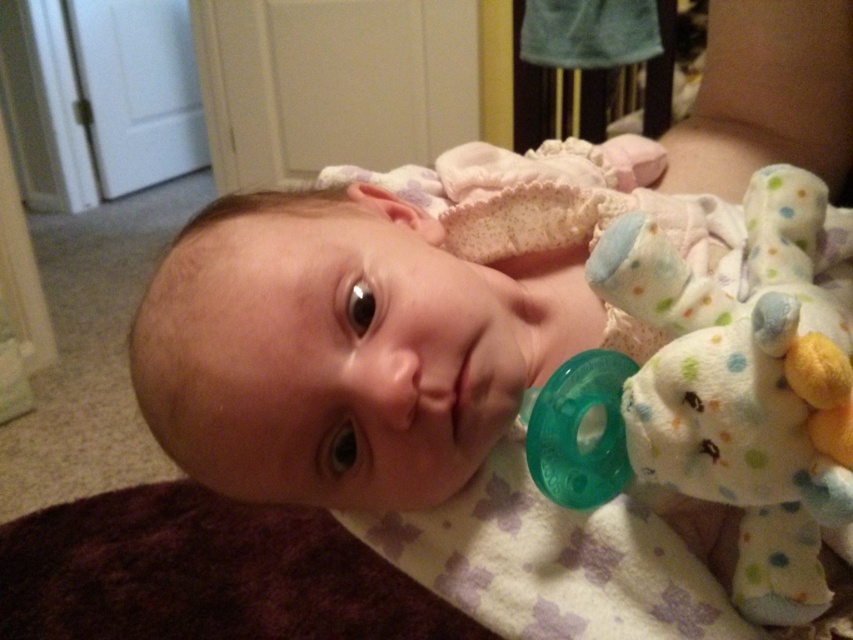
You are a photographer taking a picture of the white soft baby at center and the white dotted plush toy at right. Which object should you focus on if you want to capture the larger subject in the frame?

The white soft baby at center is larger than the white dotted plush toy at right, so you should focus on the white soft baby at center to capture the larger subject in the frame.

You are a photographer taking a picture of the white soft baby at center and the white dotted plush toy at right. Which object should you focus on first if you want to capture the taller one?

The white soft baby at center is taller than the white dotted plush toy at right, so you should focus on the white soft baby at center first.

The baby is holding a white dotted plush toy at right and has teeth at center. Which object is bigger?

The white dotted plush toy at right is larger in size than teeth at center.